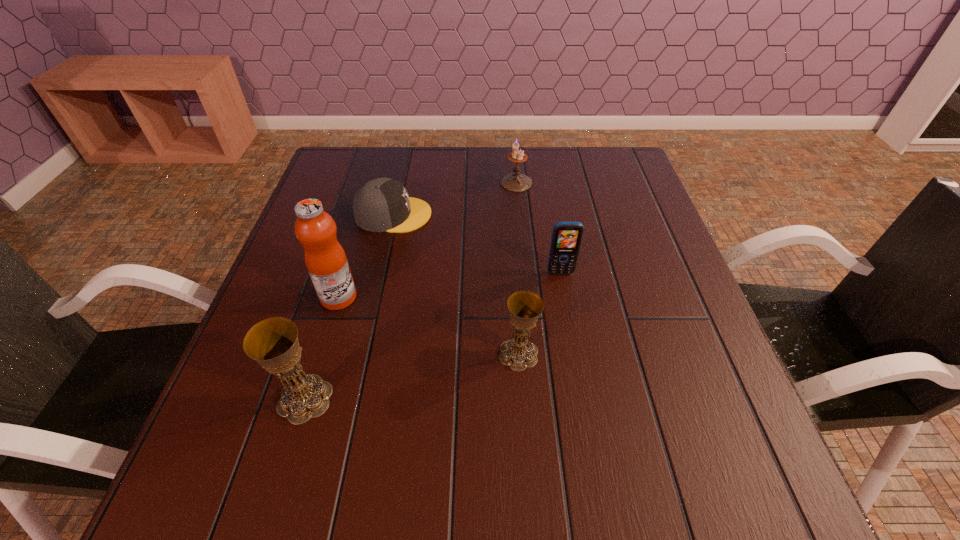
At what (x,y) coordinates should I click in order to perform the action: click on cap at the left edge. Please return your answer as a coordinate pair (x, y). Image resolution: width=960 pixels, height=540 pixels. Looking at the image, I should click on (381, 205).

This screenshot has width=960, height=540. Find the location of `fruit juice positioned at the left edge`. fruit juice positioned at the left edge is located at coordinates (326, 261).

At what (x,y) coordinates should I click in order to perform the action: click on object that is at the near left corner. Please return your answer as a coordinate pair (x, y). This screenshot has width=960, height=540. Looking at the image, I should click on (273, 343).

Identify the location of vacant region at the far edge. (525, 167).

Find the location of `vacant space at the near edge`. vacant space at the near edge is located at coordinates (515, 432).

Find the location of `free space at the left edge`. free space at the left edge is located at coordinates (283, 288).

In the image, there is a desktop. Where is `vacant space at the right edge`? vacant space at the right edge is located at coordinates (687, 388).

At what (x,y) coordinates should I click in order to perform the action: click on blank space at the far left corner. Please return your answer as a coordinate pair (x, y). The width and height of the screenshot is (960, 540). Looking at the image, I should click on (375, 154).

Locate an element on the screen. vacant space at the far right corner is located at coordinates (588, 186).

Where is `vacant area at the near right corner of the desktop`? vacant area at the near right corner of the desktop is located at coordinates (686, 411).